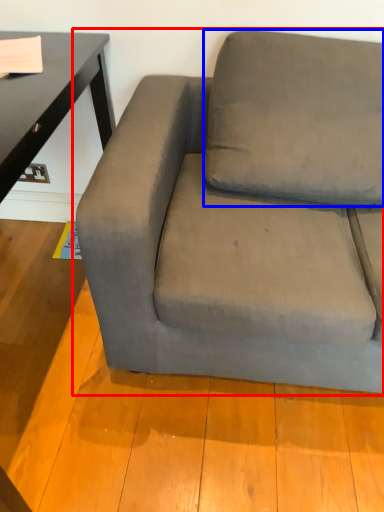
Question: Which object appears farthest to the camera in this image, studio couch (highlighted by a red box) or pillow (highlighted by a blue box)?

Choices:
 (A) studio couch
 (B) pillow

Answer: (B)